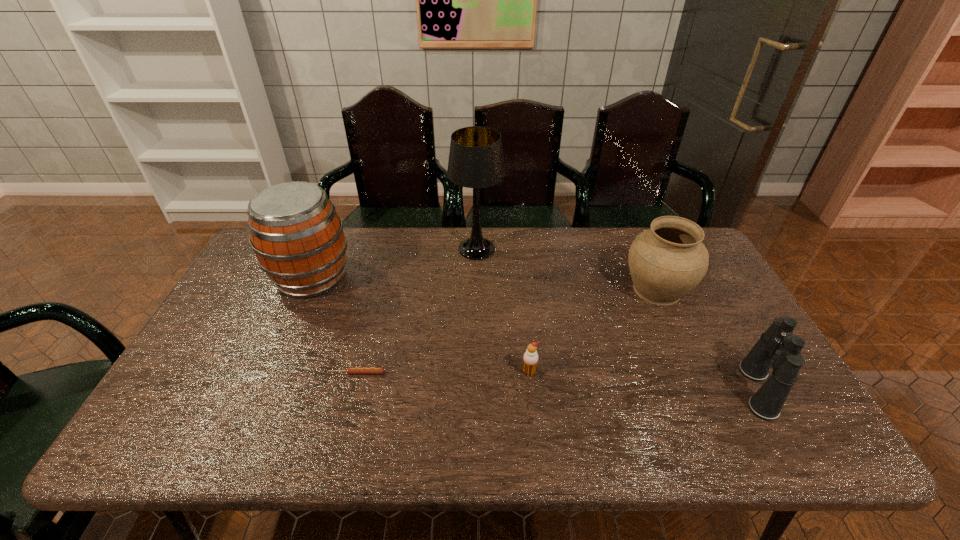
Where is `free space that is in between the binoculars and the shortest object`? This screenshot has width=960, height=540. free space that is in between the binoculars and the shortest object is located at coordinates (557, 381).

You are a GUI agent. You are given a task and a screenshot of the screen. Output one action in this format:
    pyautogui.click(x=<x>, y=<y>)
    Task: Click on the free space between the icecream and the shortest object
    
    Given the screenshot: What is the action you would take?
    pyautogui.click(x=443, y=373)

Find the location of a particular element. vacant space that's between the binoculars and the icecream is located at coordinates (643, 381).

Where is `vacant space in between the icecream and the table lamp`? The width and height of the screenshot is (960, 540). vacant space in between the icecream and the table lamp is located at coordinates (503, 310).

In order to click on vacant area between the fifth tallest object and the binoculars in this screenshot , I will do `click(643, 381)`.

Where is `free space between the urn and the fourth object from right to left`? This screenshot has height=540, width=960. free space between the urn and the fourth object from right to left is located at coordinates (566, 269).

Locate an element on the screen. free space between the tallest object and the urn is located at coordinates (566, 269).

This screenshot has height=540, width=960. I want to click on blank region between the second object from left to right and the urn, so click(507, 331).

You are a GUI agent. You are given a task and a screenshot of the screen. Output one action in this format:
    pyautogui.click(x=<x>, y=<y>)
    Task: Click on the free point between the binoculars and the urn
    This screenshot has width=960, height=540.
    Given the screenshot: What is the action you would take?
    pyautogui.click(x=708, y=340)

I want to click on object that is the closest to the urn, so click(777, 348).